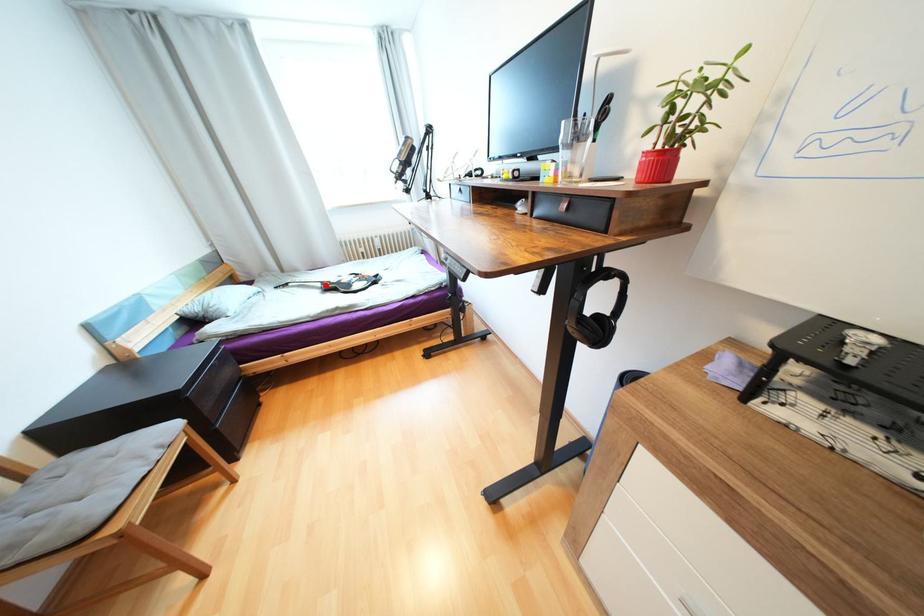
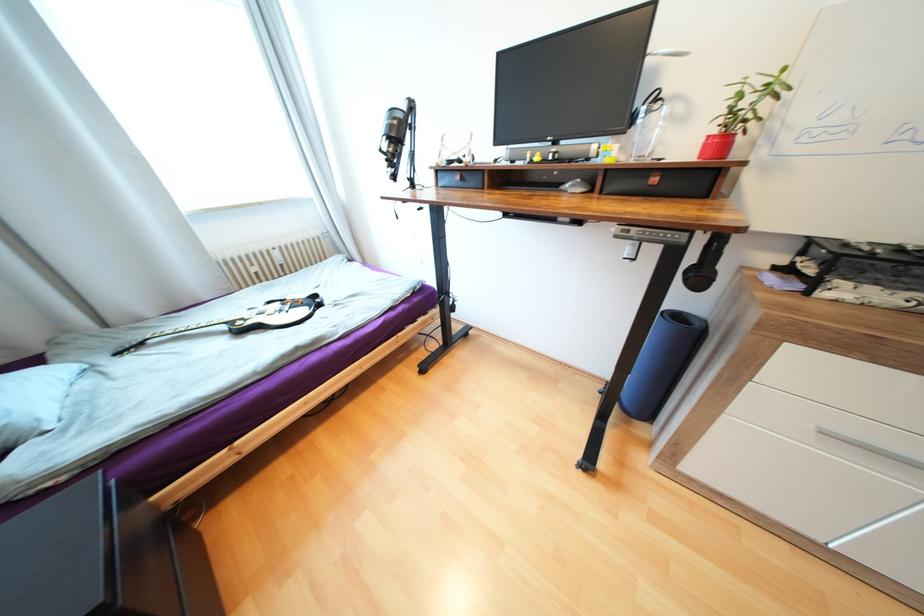
Question: I am providing you with two images of the same scene from different viewpoints. Image1 has a red point marked. In image2, the corresponding 3D location appears at what relative position? Reply with the corresponding letter.

Choices:
 (A) Closer
 (B) Farther

Answer: (B)